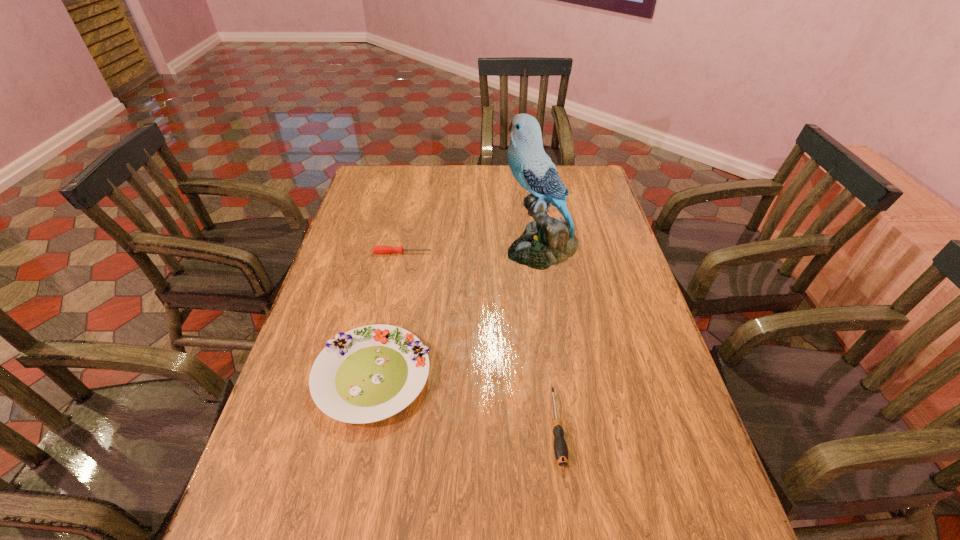
Locate an element on the screen. vacant space located 0.240m on the left of the nearer screwdriver is located at coordinates (441, 427).

In order to click on free space located 0.300m at the tip of the farther screwdriver in this screenshot , I will do `click(525, 253)`.

The width and height of the screenshot is (960, 540). In order to click on salad plate present at the left edge in this screenshot , I will do `click(368, 374)`.

This screenshot has height=540, width=960. I want to click on screwdriver that is at the left edge, so click(x=376, y=249).

The width and height of the screenshot is (960, 540). I want to click on object that is at the right edge, so click(x=547, y=241).

At what (x,y) coordinates should I click in order to perform the action: click on free location at the far edge of the desktop. Please return your answer as a coordinate pair (x, y). This screenshot has width=960, height=540. Looking at the image, I should click on (430, 195).

This screenshot has height=540, width=960. I want to click on vacant space at the left edge of the desktop, so click(252, 521).

Where is `vacant space at the right edge`? vacant space at the right edge is located at coordinates (618, 278).

This screenshot has width=960, height=540. What are the coordinates of `vacant space in between the salad plate and the taller screwdriver` in the screenshot? It's located at (465, 402).

Locate an element on the screen. The image size is (960, 540). free area in between the shorter screwdriver and the third tallest object is located at coordinates (480, 340).